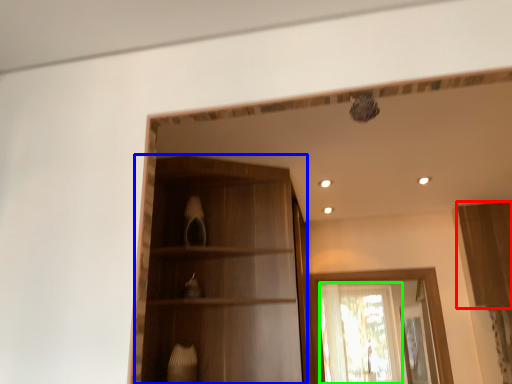
Question: Which object is the farthest from cabinetry (highlighted by a red box)? Choose among these: cabinetry (highlighted by a blue box) or window (highlighted by a green box).

Choices:
 (A) cabinetry
 (B) window

Answer: (A)